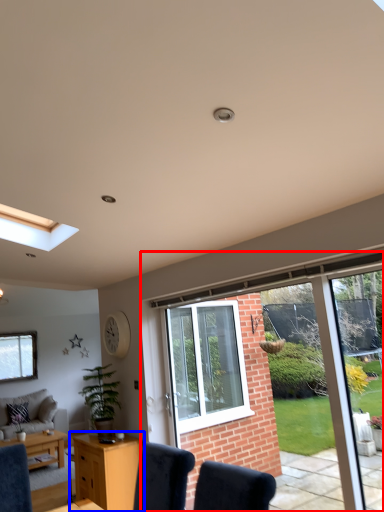
Question: Which object appears farthest to the camera in this image, window (highlighted by a red box) or desk (highlighted by a blue box)?

Choices:
 (A) window
 (B) desk

Answer: (B)